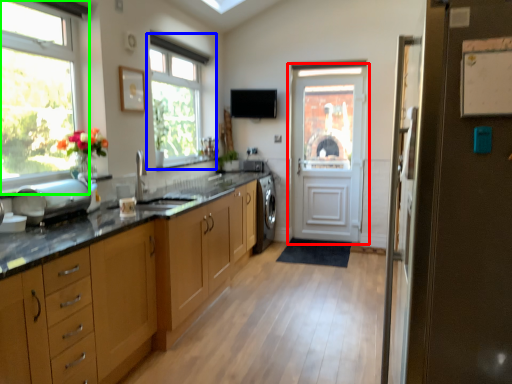
Question: Which object is positioned closest to door (highlighted by a red box)? Select from window (highlighted by a blue box) and window (highlighted by a green box).

Choices:
 (A) window
 (B) window

Answer: (A)